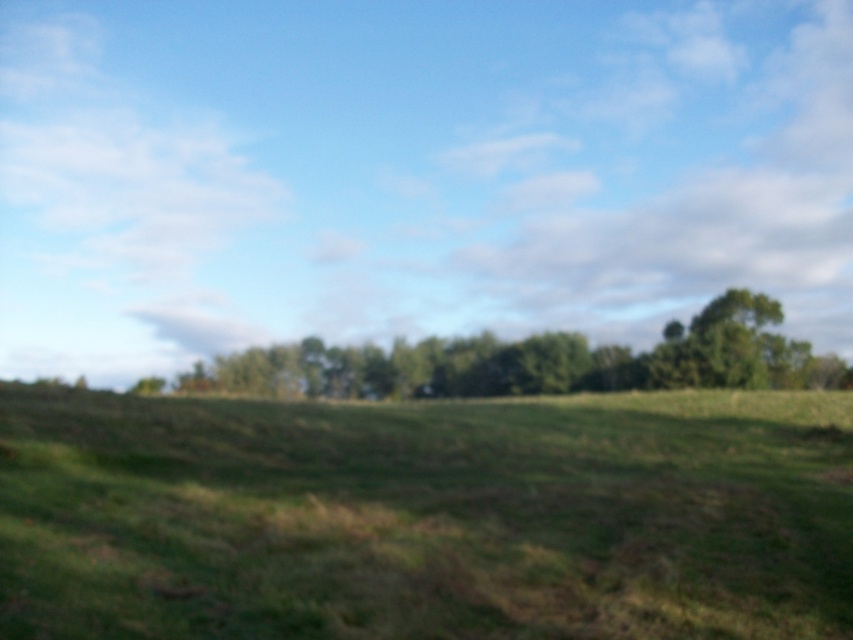
Question: Is green grassy field at center in front of green leafy tree at center?

Choices:
 (A) yes
 (B) no

Answer: (A)

Question: Can you confirm if green grassy field at center is positioned to the right of green leafy tree at center?

Choices:
 (A) yes
 (B) no

Answer: (B)

Question: Which object appears closest to the camera in this image?

Choices:
 (A) green grassy field at center
 (B) green leafy tree at center

Answer: (A)

Question: Among these objects, which one is nearest to the camera?

Choices:
 (A) green leafy tree at center
 (B) green grassy field at center

Answer: (B)

Question: Which object is farther from the camera taking this photo?

Choices:
 (A) green grassy field at center
 (B) green leafy tree at center

Answer: (B)

Question: Is green grassy field at center in front of green leafy tree at center?

Choices:
 (A) yes
 (B) no

Answer: (A)